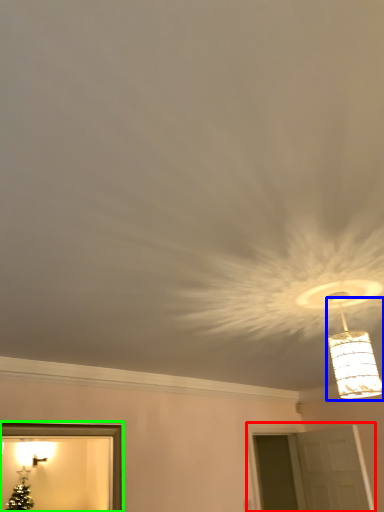
Question: Which object is the closest to the window (highlighted by a red box)? Choose among these: lamp (highlighted by a blue box) or picture frame (highlighted by a green box).

Choices:
 (A) lamp
 (B) picture frame

Answer: (B)